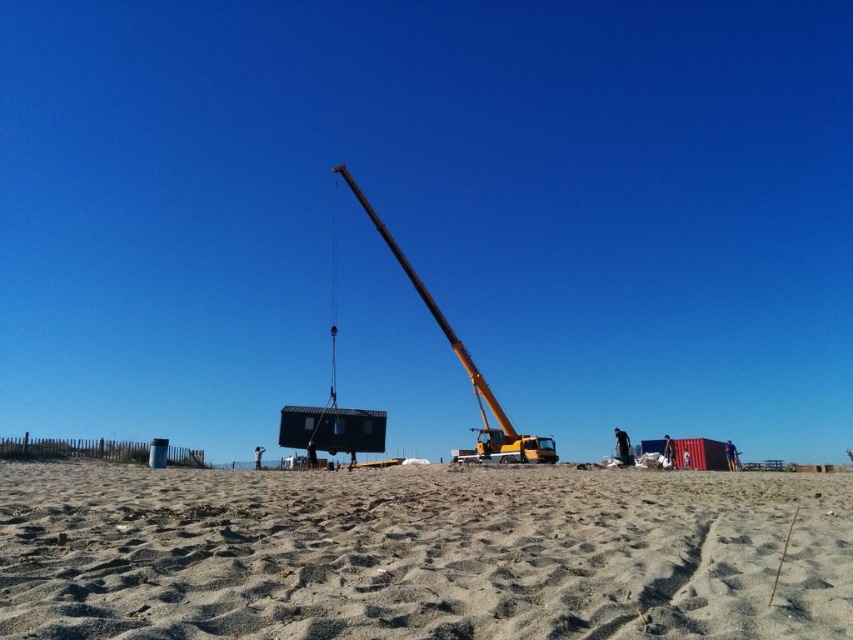
Describe the element at coordinates (421, 554) in the screenshot. I see `sandy beach at lower center` at that location.

Is sandy beach at lower center wider than yellow metallic crane at center?

Indeed, sandy beach at lower center has a greater width compared to yellow metallic crane at center.

Describe the element at coordinates (421, 554) in the screenshot. I see `sandy beach at lower center` at that location.

This screenshot has width=853, height=640. I want to click on sandy beach at lower center, so click(421, 554).